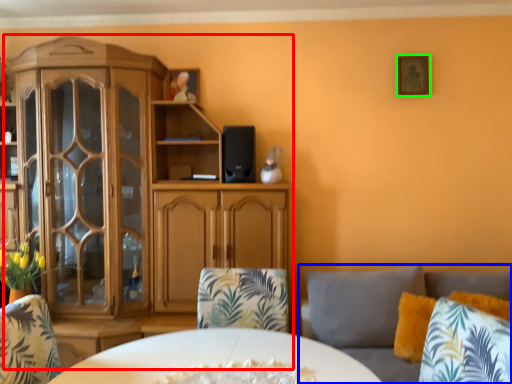
Question: Considering the real-world distances, which object is closest to cabinetry (highlighted by a red box)? studio couch (highlighted by a blue box) or picture frame (highlighted by a green box).

Choices:
 (A) studio couch
 (B) picture frame

Answer: (A)